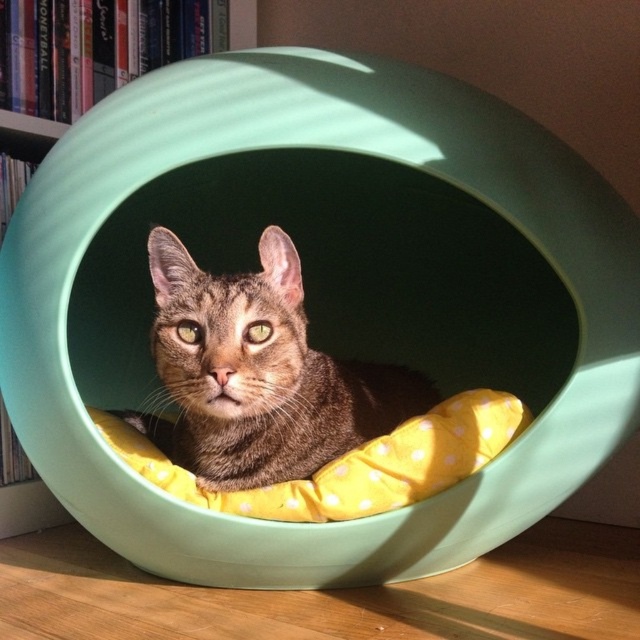
Consider the image. Is brown fur cat at center bigger than matte plastic bookshelf at upper left?

Indeed, brown fur cat at center has a larger size compared to matte plastic bookshelf at upper left.

Which of these two, brown fur cat at center or matte plastic bookshelf at upper left, stands taller?

brown fur cat at center is taller.

Between point (307, 452) and point (250, 38), which one is positioned in front?

Point (307, 452)

Locate an element on the screen. This screenshot has height=640, width=640. brown fur cat at center is located at coordinates (259, 372).